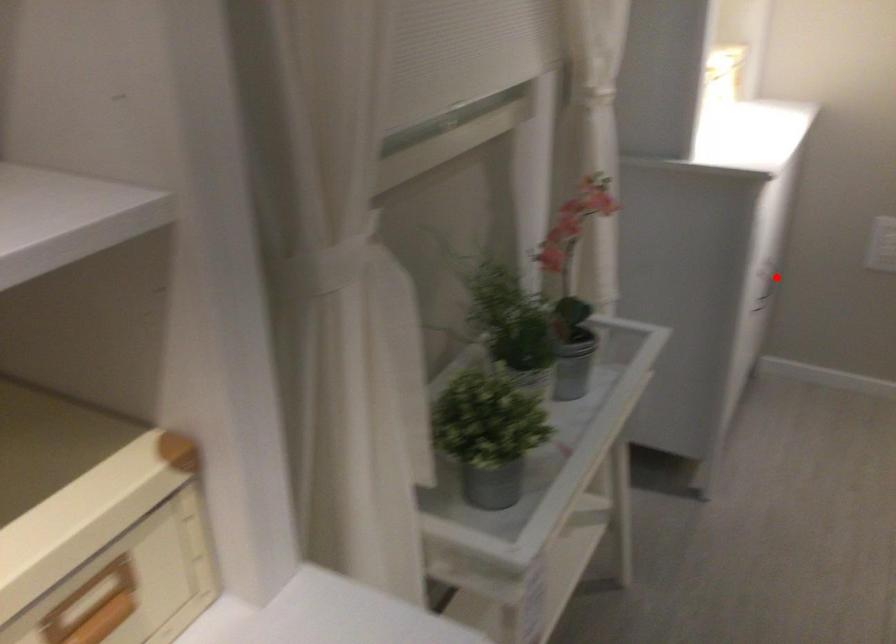
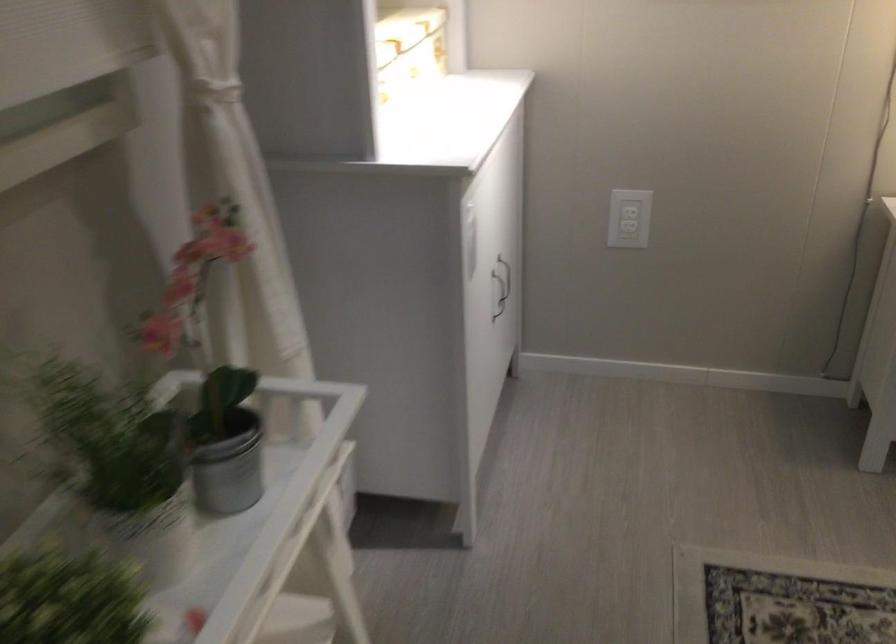
Where in the second image is the point corresponding to the highlighted location from the first image?

(505, 277)